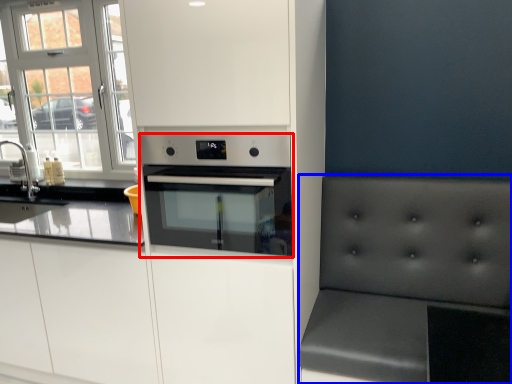
Question: Which of the following is the closest to the observer, home appliance (highlighted by a red box) or armchair (highlighted by a blue box)?

Choices:
 (A) home appliance
 (B) armchair

Answer: (B)